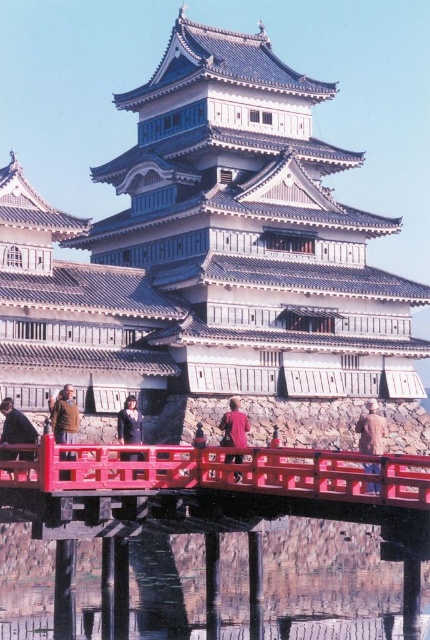
How much distance is there between red fabric person at center and dark blue fabric jacket at center?

red fabric person at center and dark blue fabric jacket at center are 3.68 meters apart.

Is red fabric person at center shorter than dark blue fabric jacket at center?

Yes, red fabric person at center is shorter than dark blue fabric jacket at center.

The width and height of the screenshot is (430, 640). Describe the element at coordinates (233, 426) in the screenshot. I see `red fabric person at center` at that location.

I want to click on red fabric person at center, so click(x=233, y=426).

Is smooth wooden bridge at center to the left of matte black person at center from the viewer's perspective?

Indeed, smooth wooden bridge at center is positioned on the left side of matte black person at center.

Is point (128, 552) positioned behind point (199, 426)?

No, it is in front of (199, 426).

Is point (194, 513) less distant than point (200, 438)?

Yes.

You are a GUI agent. You are given a task and a screenshot of the screen. Output one action in this format:
    pyautogui.click(x=<x>, y=<y>)
    Task: Click on the smooth wooden bridge at center
    
    Given the screenshot: What is the action you would take?
    pyautogui.click(x=215, y=500)

Who is taller, brown leather jacket at center or matte black person at center?

Standing taller between the two is brown leather jacket at center.

Does brown leather jacket at center come in front of matte black person at center?

Yes, it is in front of matte black person at center.

This screenshot has width=430, height=640. Identify the location of brown leather jacket at center. (64, 417).

Locate an element on the screen. The image size is (430, 640). brown leather jacket at center is located at coordinates (64, 417).